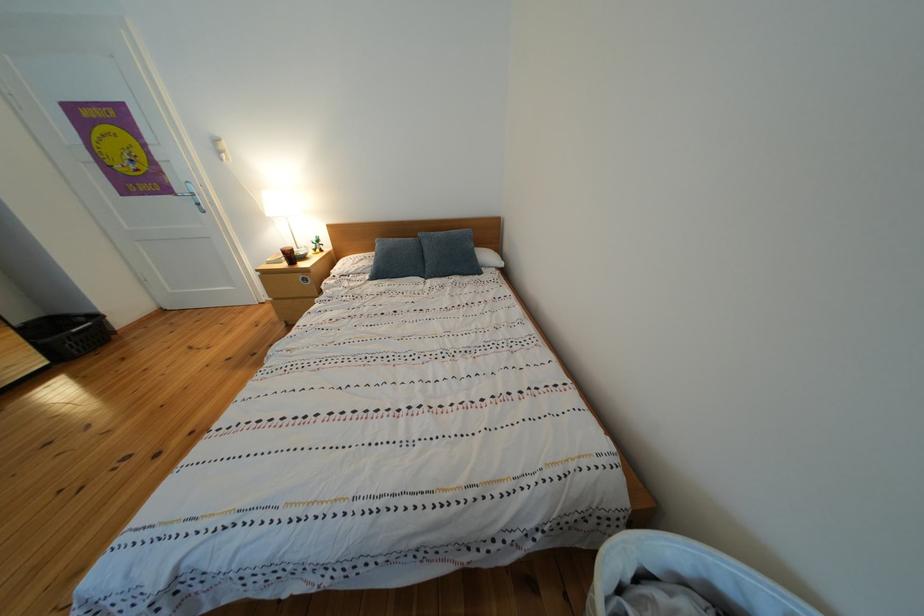
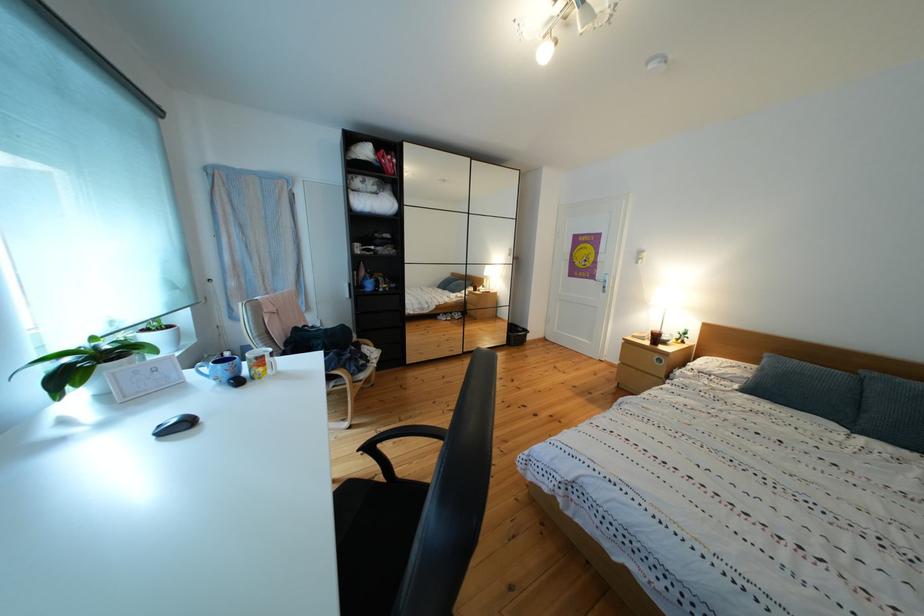
Question: The camera is either moving clockwise (left) or counter-clockwise (right) around the object. The first image is from the beginning of the video and the second image is from the end. Is the camera moving left or right when shooting the video?

Choices:
 (A) Left
 (B) Right

Answer: (B)